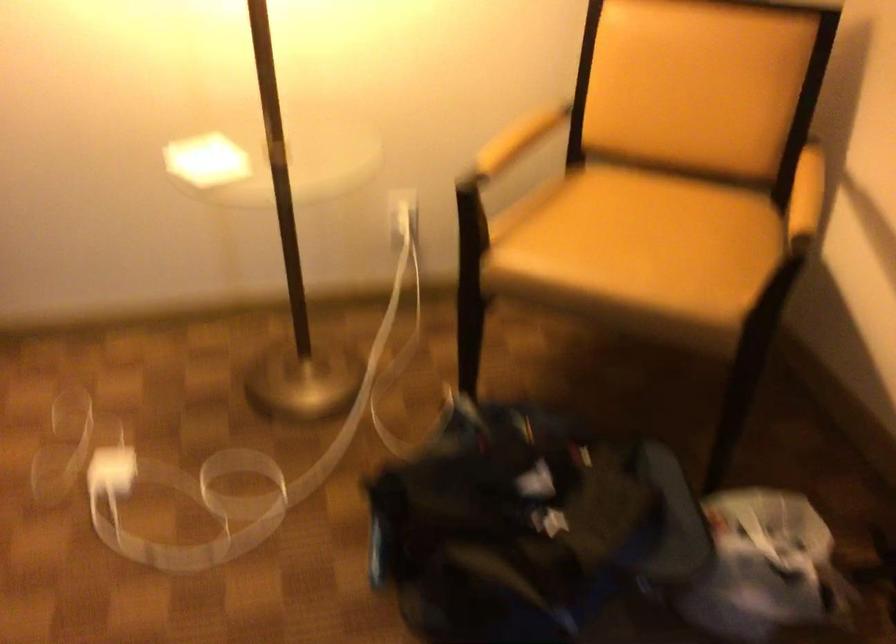
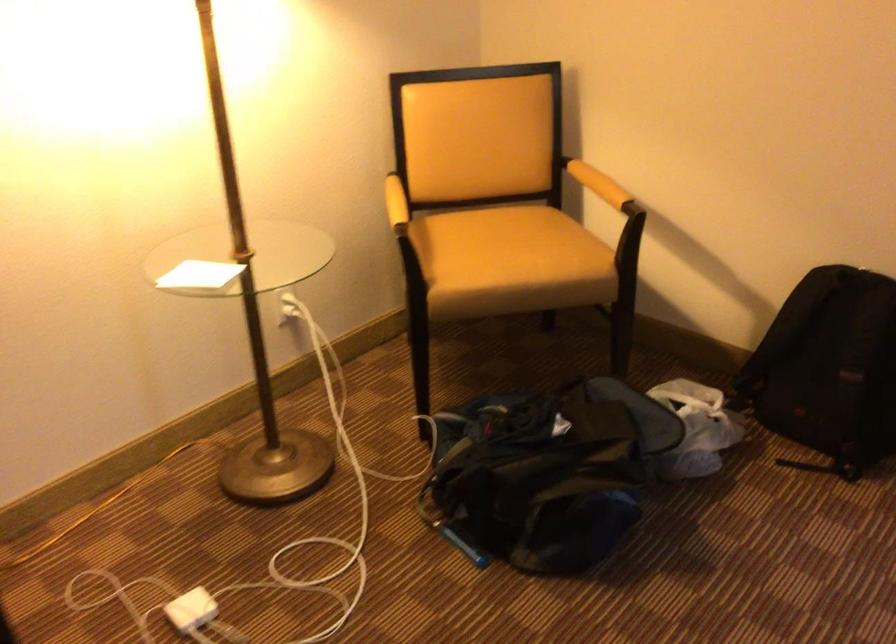
In the second image, find the point that corresponds to pixel 201 152 in the first image.

(199, 275)